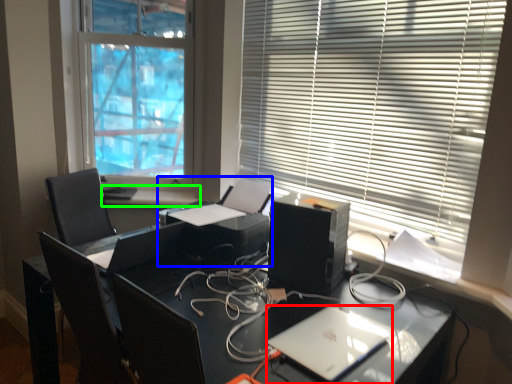
Question: Considering the real-world distances, which object is closest to laptop (highlighted by a red box)? printer (highlighted by a blue box) or window sill (highlighted by a green box).

Choices:
 (A) printer
 (B) window sill

Answer: (A)